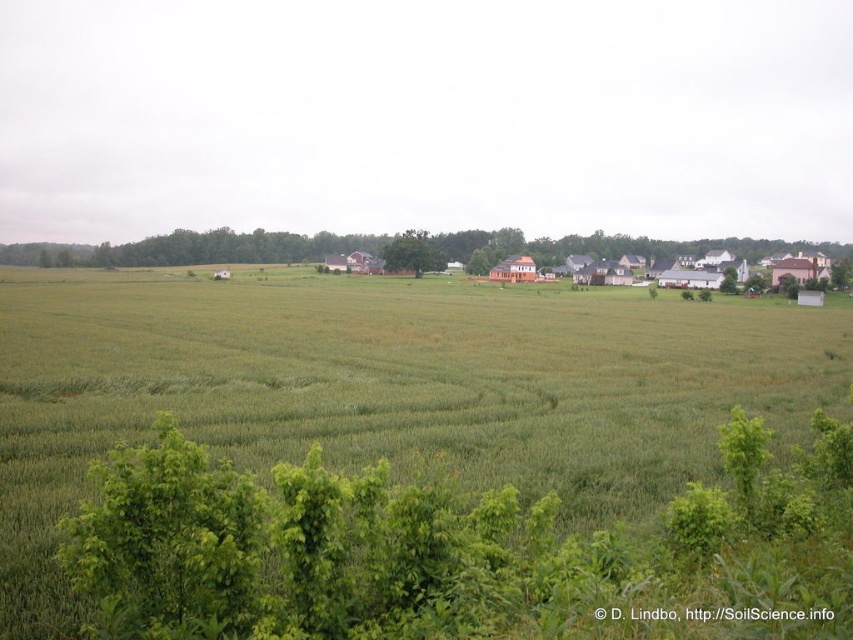
You are a landscape architect designing a new park and want to incorporate two types of trees similar to the ones in the image. The first is the green leafy tree at upper center and the second is the green leafy tree at center. Which tree should you choose if you want a larger tree for shade in the park?

The green leafy tree at upper center is bigger than the green leafy tree at center, so you should choose the green leafy tree at upper center for a larger tree for shade in the park.

You are standing in the rural landscape and want to walk from the point at coordinates point (595, 352) to the point at coordinates point (270, 252). Which direction should you face to move towards the second point?

To move from point (595, 352) to point (270, 252), you should face northwest because point (595, 352) is closer to the viewer than point (270, 252).

You are a drone operator planning to fly a drone over the green grassy field at center and the green leafy tree at upper center. Based on their widths, which object is wider?

The green leafy tree at upper center is wider than the green grassy field at center.